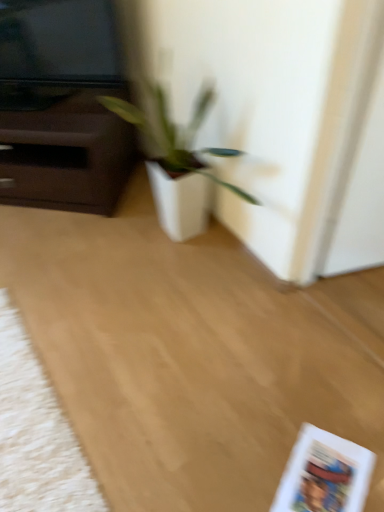
This screenshot has width=384, height=512. I want to click on free space between white matte paperback book at lower right and white fluffy mat at lower left, so click(x=154, y=409).